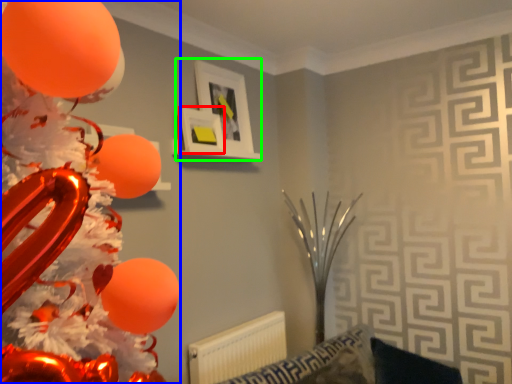
Question: Considering the real-world distances, which object is closest to picture frame (highlighted by a red box)? balloon (highlighted by a blue box) or picture frame (highlighted by a green box).

Choices:
 (A) balloon
 (B) picture frame

Answer: (B)